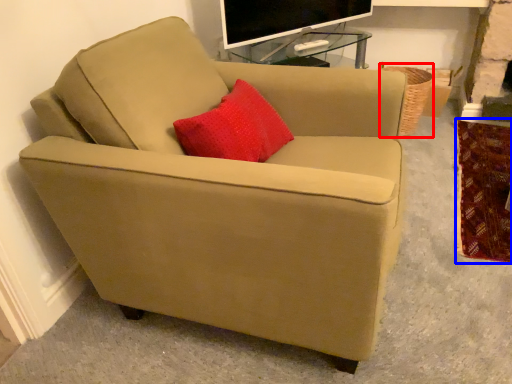
Question: Among these objects, which one is farthest to the camera, basket (highlighted by a red box) or blanket (highlighted by a blue box)?

Choices:
 (A) basket
 (B) blanket

Answer: (A)